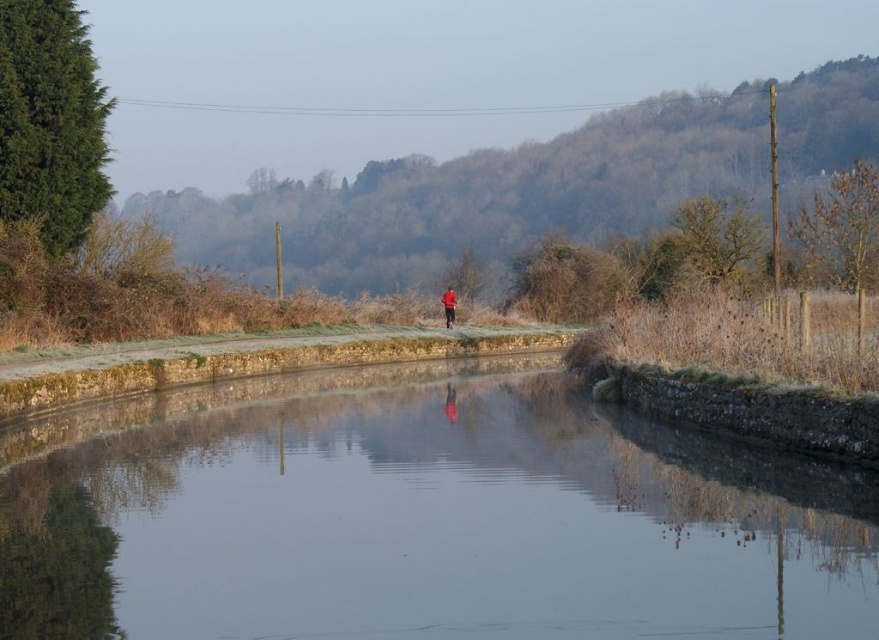
Does clear glass water at center appear on the left side of red matte jacket at center?

Yes, clear glass water at center is to the left of red matte jacket at center.

Can you confirm if clear glass water at center is bigger than red matte jacket at center?

Yes, clear glass water at center is bigger than red matte jacket at center.

Who is more distant from viewer, (492, 358) or (449, 316)?

Point (449, 316)

I want to click on clear glass water at center, so click(420, 516).